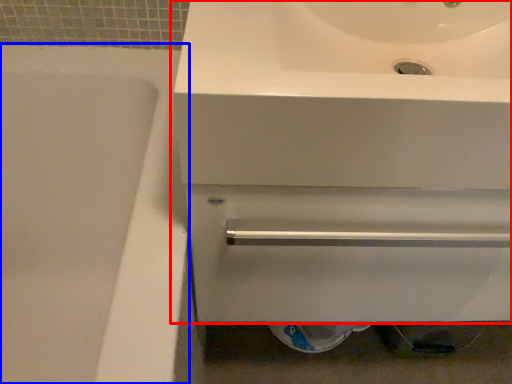
Question: Which object is further to the camera taking this photo, sink (highlighted by a red box) or bath (highlighted by a blue box)?

Choices:
 (A) sink
 (B) bath

Answer: (A)